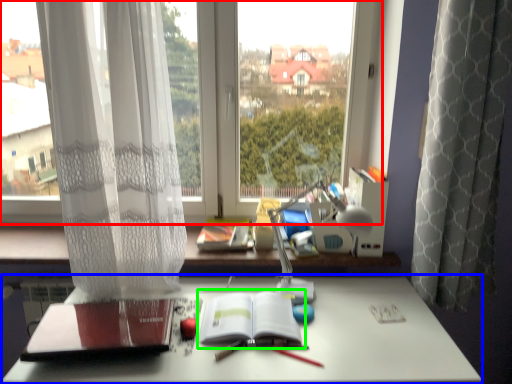
Question: Based on their relative distances, which object is nearer to window (highlighted by a red box)? Choose from desk (highlighted by a blue box) and paperback book (highlighted by a green box).

Choices:
 (A) desk
 (B) paperback book

Answer: (B)